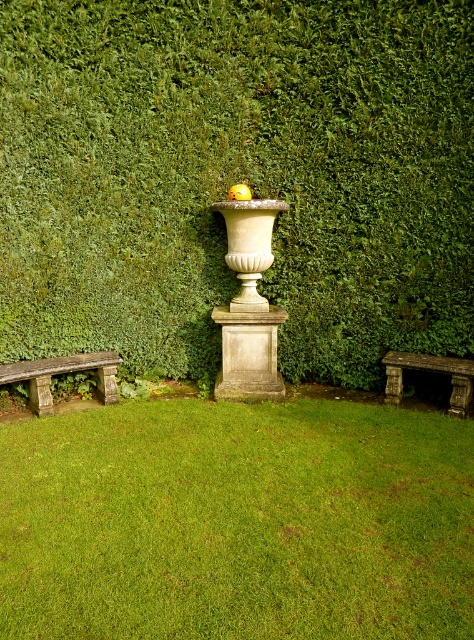
Question: Which object is farther from the camera taking this photo?

Choices:
 (A) stone bench at lower left
 (B) green leafy hedge at center
 (C) rusty stone bench at lower right
 (D) green grass at center

Answer: (C)

Question: Does green grass at center appear on the left side of rusty stone bench at lower right?

Choices:
 (A) yes
 (B) no

Answer: (A)

Question: Is stone bench at lower left behind rusty stone bench at lower right?

Choices:
 (A) yes
 (B) no

Answer: (B)

Question: Which of the following is the farthest from the observer?

Choices:
 (A) stone bench at lower left
 (B) green grass at center

Answer: (A)

Question: Considering the relative positions of green grass at center and rusty stone bench at lower right in the image provided, where is green grass at center located with respect to rusty stone bench at lower right?

Choices:
 (A) right
 (B) left

Answer: (B)

Question: Estimate the real-world distances between objects in this image. Which object is farther from the green leafy hedge at center?

Choices:
 (A) rusty stone bench at lower right
 (B) green grass at center

Answer: (B)